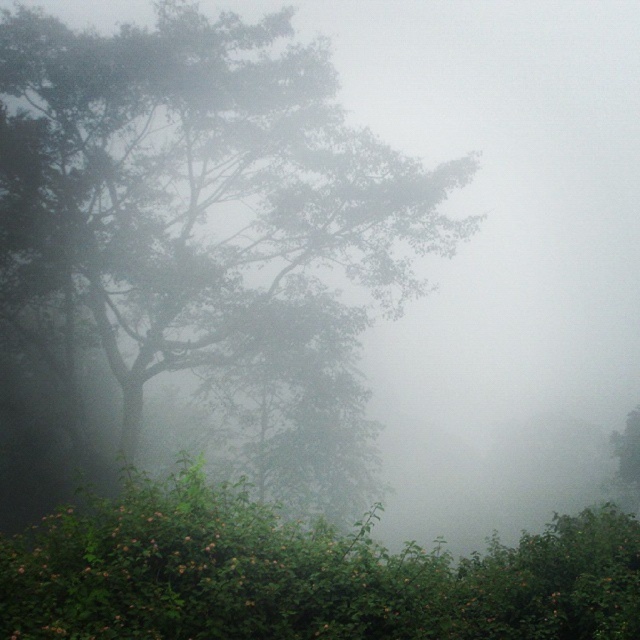
Looking at this image, which of these two, green leafy tree at left or green leafy bush at lower center, stands taller?

Standing taller between the two is green leafy tree at left.

Measure the distance from green leafy tree at left to green leafy bush at lower center.

green leafy tree at left and green leafy bush at lower center are 83.63 meters apart from each other.

This screenshot has width=640, height=640. Describe the element at coordinates (198, 189) in the screenshot. I see `green leafy tree at left` at that location.

This screenshot has height=640, width=640. Identify the location of green leafy tree at left. pos(198,189).